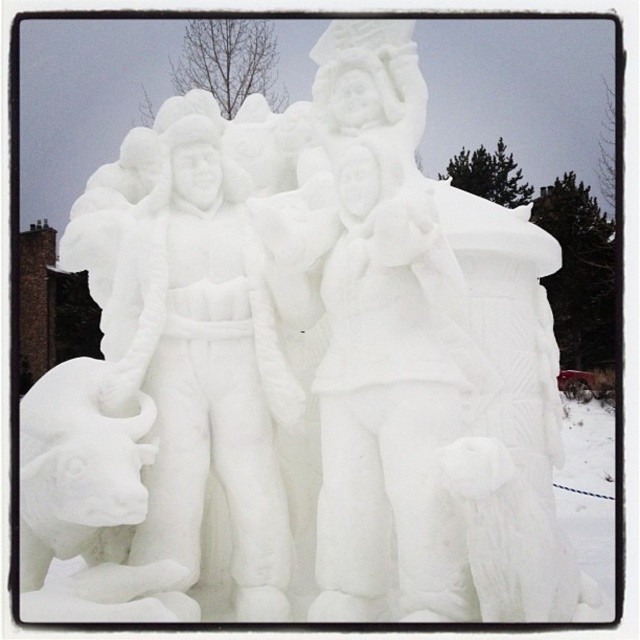
You are standing at the origin point in the image. The white snow sculpture at center is at coordinates approximately 0.6 on both the x and y axes. If you want to move directly towards it, which direction should you head?

Since the white snow sculpture at center is located at coordinates approximately 0.6 on both the x and y axes, you should move northeast to reach it directly.